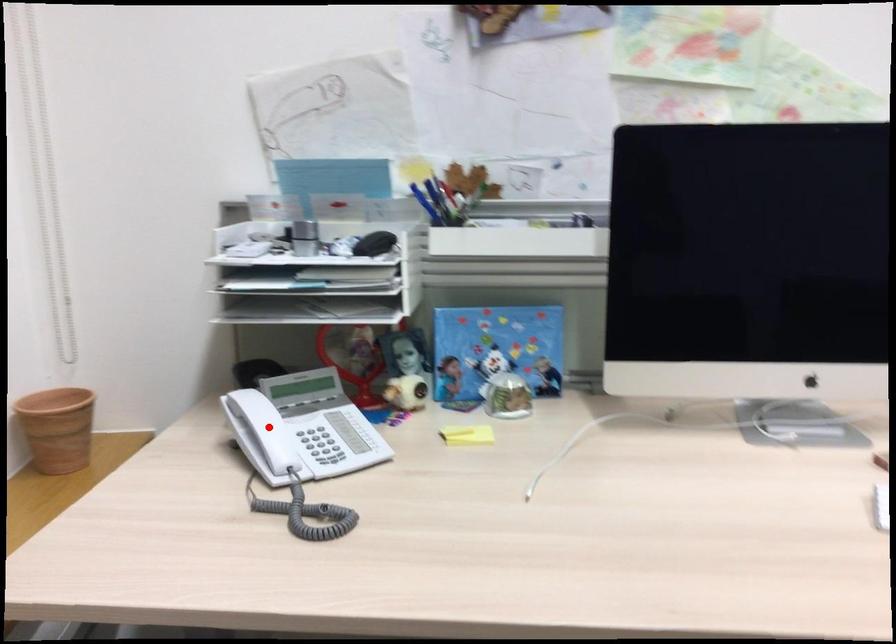
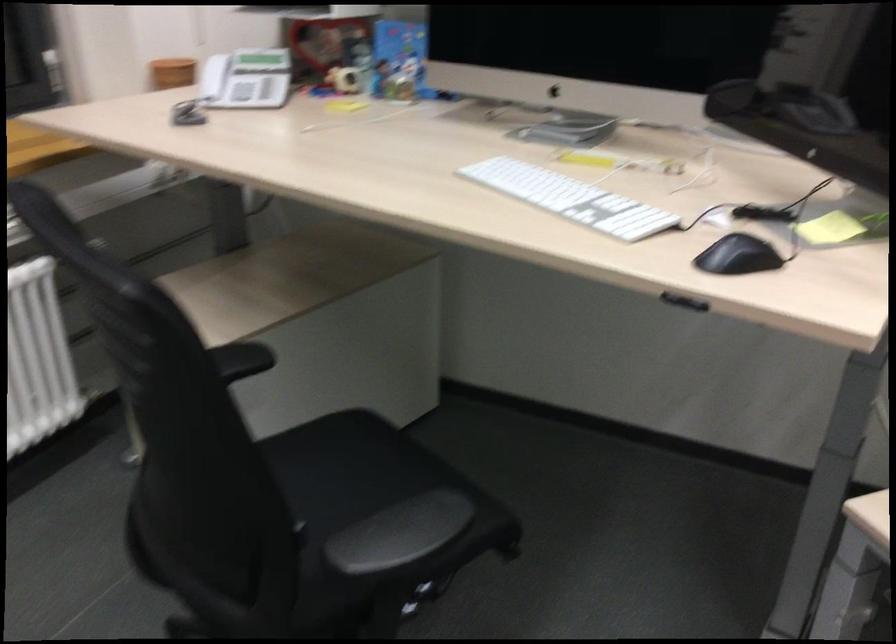
The point at the highlighted location is marked in the first image. Where is the corresponding point in the second image?

(212, 77)